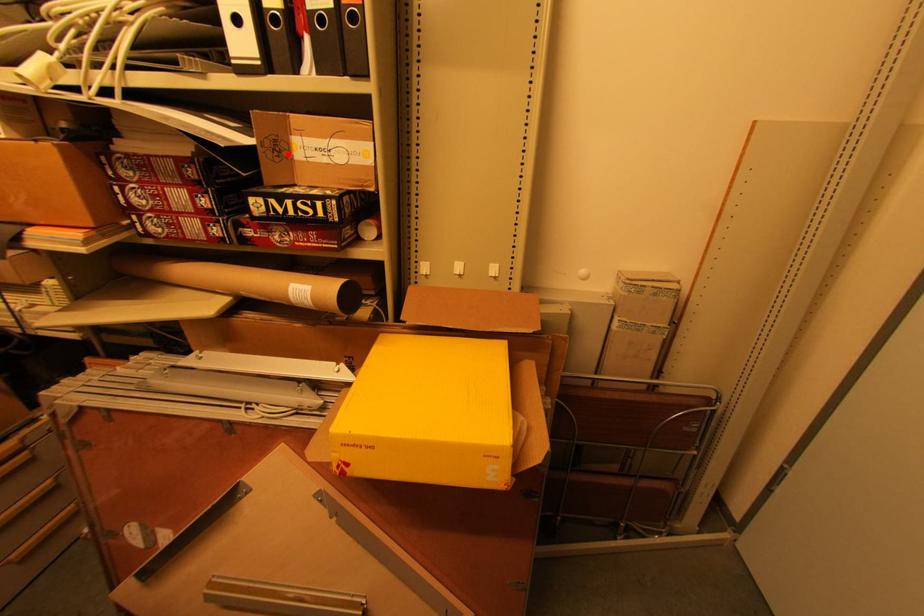
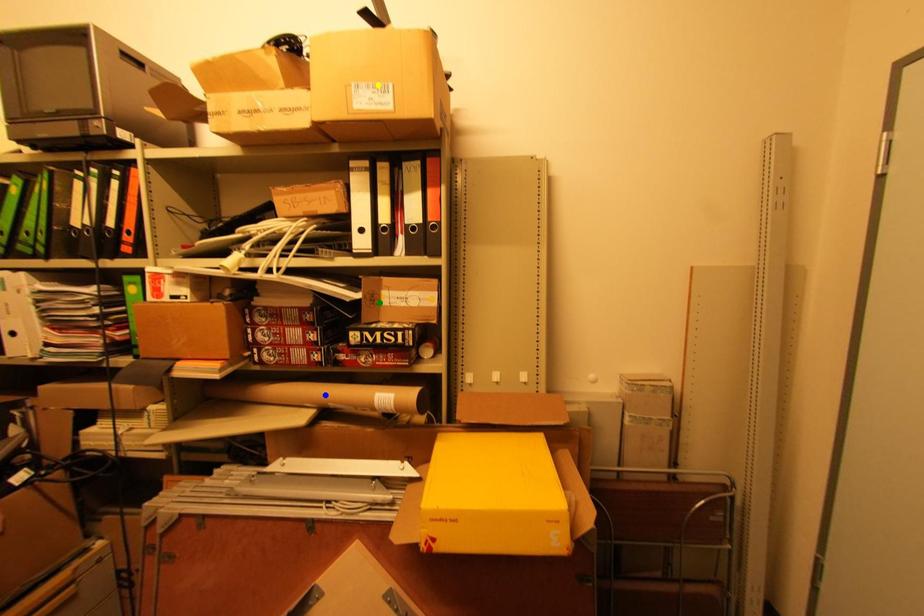
Question: I am providing you with two images of the same scene from different viewpoints. A red point is marked on the first image. You are given multiple points on the second image. Which mark in image 2 goes with the point in image 1?

Choices:
 (A) blue point
 (B) green point
 (C) yellow point

Answer: (B)